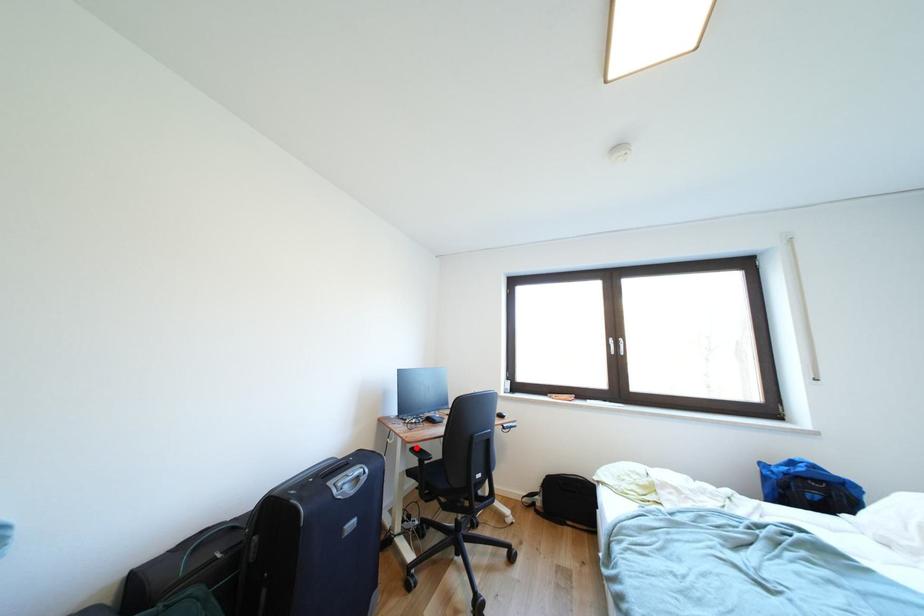
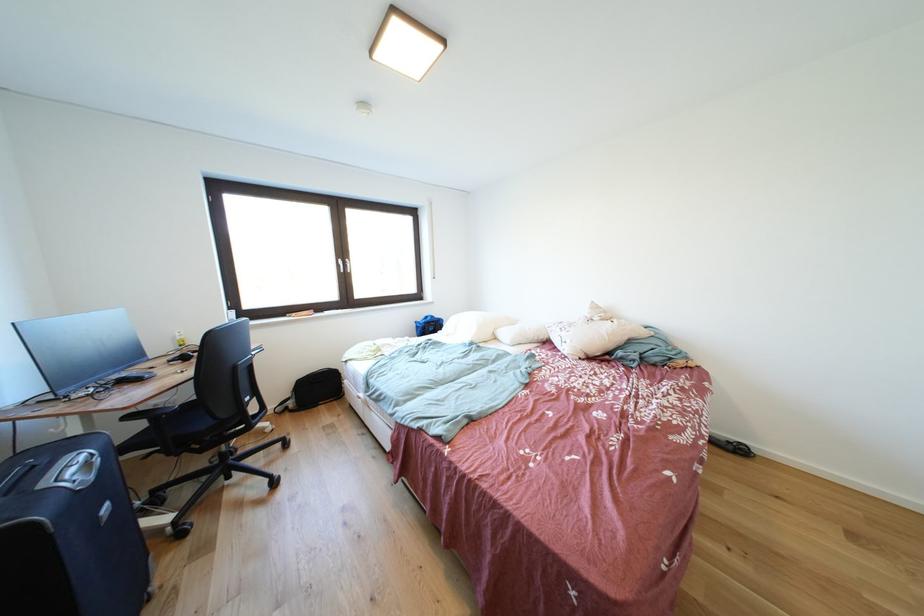
Question: I am providing you with two images of the same scene from different viewpoints. A red point is marked on the first image. Is the red point's position out of view in image 2?

Choices:
 (A) Yes
 (B) No

Answer: (B)